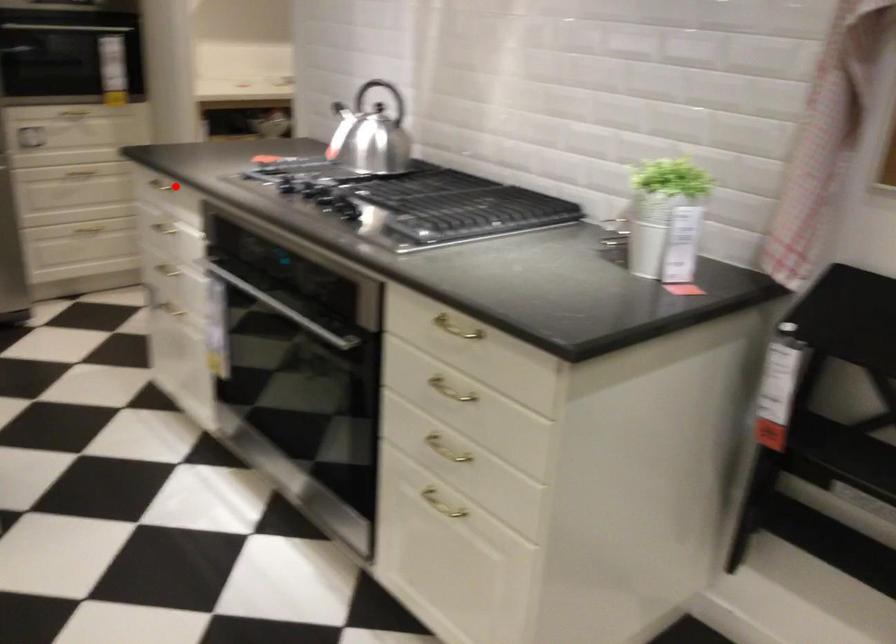
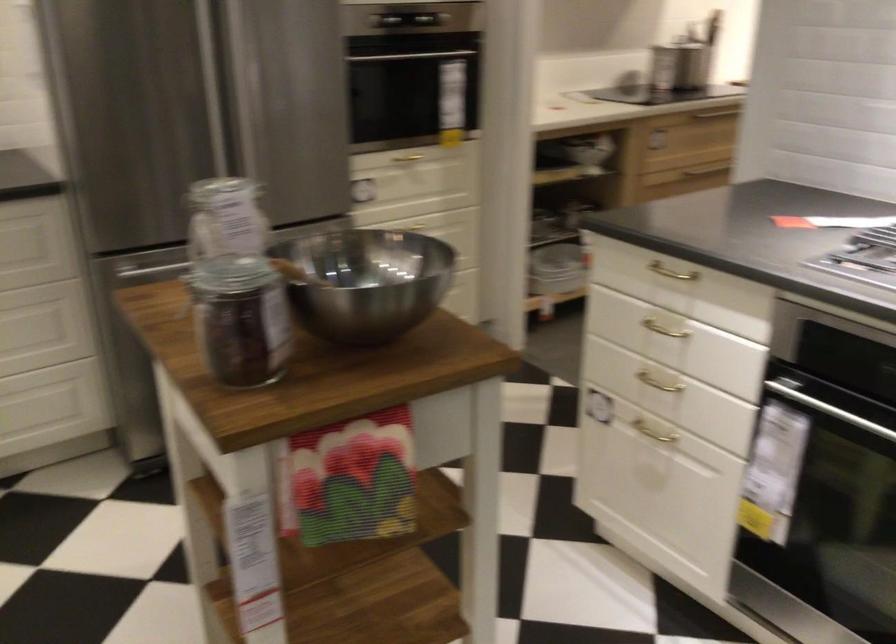
Question: I am providing you with two images of the same scene from different viewpoints. Image1 has a red point marked. In image2, the corresponding 3D location appears at what relative position? Reply with the corresponding letter.

Choices:
 (A) Closer
 (B) Farther

Answer: (A)